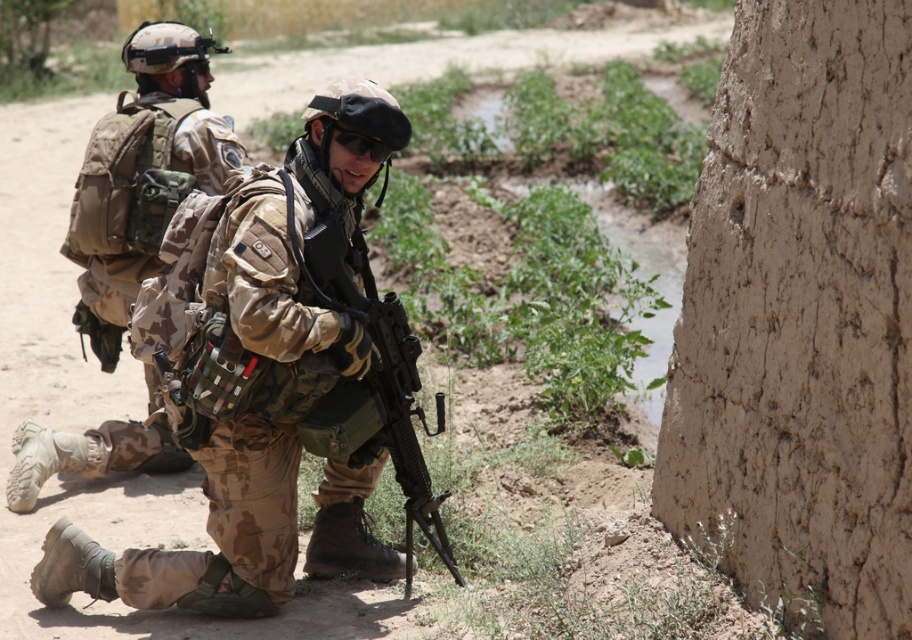
Based on the scene description, which soldier, the camouflage fabric uniform at center or the camouflage fabric uniform at left, has a wider uniform?

The camouflage fabric uniform at center might be wider than camouflage fabric uniform at left according to the description.

You are a military analyst observing the scene. You need to determine the positioning of the soldiers. Is the matte black rifle at center located in front of or behind the camouflage fabric uniform at left?

The matte black rifle at center is behind the camouflage fabric uniform at left.

Based on the scene described, which soldier is positioned to the right when comparing the camouflage fabric uniform at center and the camouflage fabric uniform at left?

The camouflage fabric uniform at center is to the right of the camouflage fabric uniform at left.